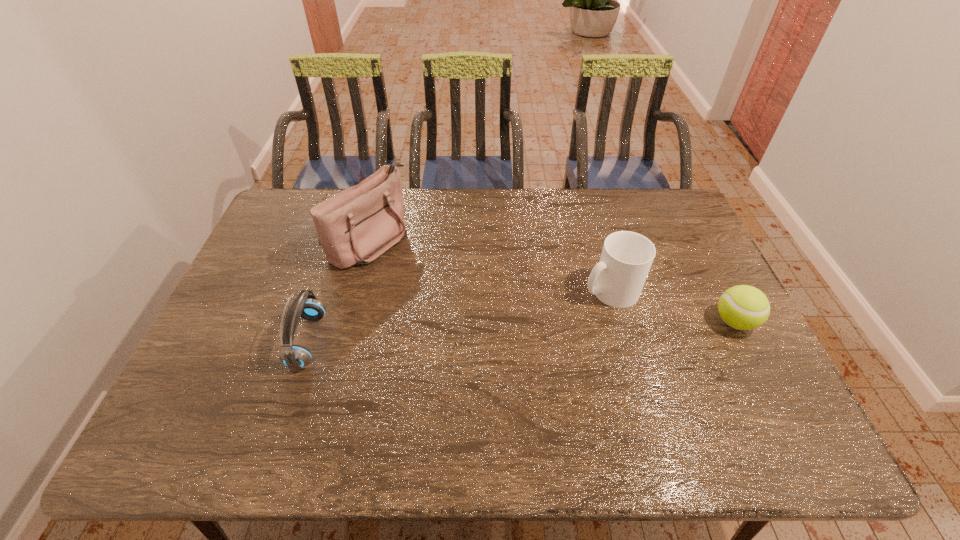
Identify the location of headset. This screenshot has height=540, width=960. (296, 357).

You are a GUI agent. You are given a task and a screenshot of the screen. Output one action in this format:
    pyautogui.click(x=<x>, y=<y>)
    Task: Click on the shortest object
    
    Given the screenshot: What is the action you would take?
    pyautogui.click(x=743, y=307)

Where is `the rightmost object`? The width and height of the screenshot is (960, 540). the rightmost object is located at coordinates (743, 307).

Where is `the tallest object`? Image resolution: width=960 pixels, height=540 pixels. the tallest object is located at coordinates (357, 225).

Locate an element on the screen. The image size is (960, 540). the farthest object is located at coordinates (357, 225).

Locate an element on the screen. Image resolution: width=960 pixels, height=540 pixels. mug is located at coordinates (617, 280).

Identify the location of the second object from right to left. The height and width of the screenshot is (540, 960). (617, 280).

Image resolution: width=960 pixels, height=540 pixels. Identify the location of free location located 0.400m on the ear cups of the second shortest object. (473, 341).

The width and height of the screenshot is (960, 540). Identify the location of free spot located on the back of the shortest object. (682, 217).

This screenshot has width=960, height=540. I want to click on vacant region located 0.060m on the front pocket of the tallest object, so click(x=411, y=266).